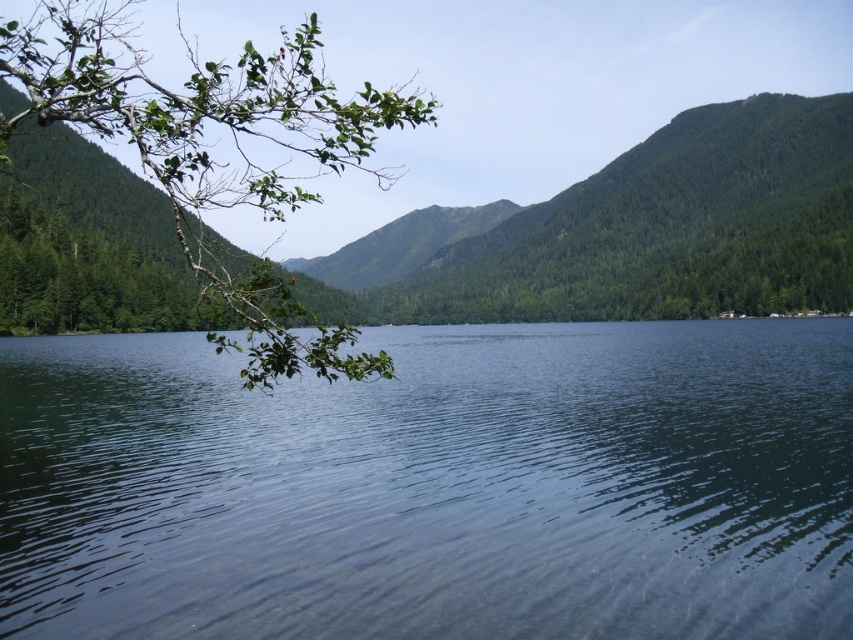
In the scene shown: Who is taller, clear water at center or green leafy branch at upper left?

green leafy branch at upper left is taller.

This screenshot has height=640, width=853. Find the location of `clear water at center`. clear water at center is located at coordinates (434, 486).